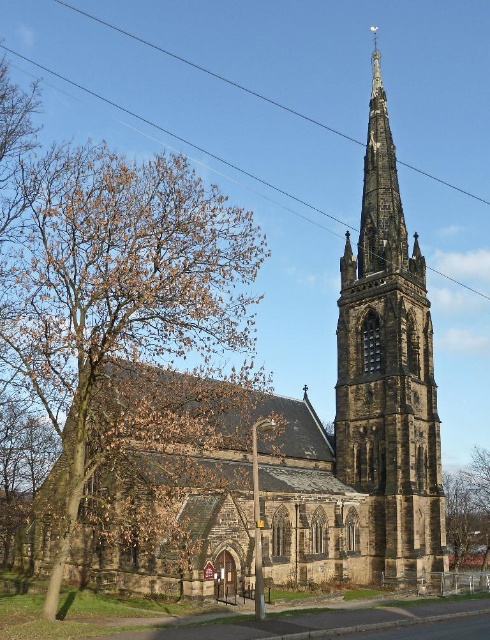
Does brown stone spire at center appear on the right side of brown leafy tree at lower right?

Incorrect, brown stone spire at center is not on the right side of brown leafy tree at lower right.

Does point (386, 186) lie in front of point (483, 461)?

Yes, it is.

Who is more forward, (344, 264) or (462, 484)?

Positioned in front is point (344, 264).

You are a GUI agent. You are given a task and a screenshot of the screen. Output one action in this format:
    pyautogui.click(x=<x>, y=<y>)
    Task: Click on the brown stone spire at center
    This screenshot has height=640, width=490.
    Given the screenshot: What is the action you would take?
    click(389, 372)

Is the position of brown leafy tree at left more distant than that of black wire at upper center?

No, it is not.

Is brown leafy tree at left thinner than black wire at upper center?

Yes, brown leafy tree at left is thinner than black wire at upper center.

Does point (103, 278) come in front of point (280, 193)?

Yes.

Locate an element on the screen. brown leafy tree at left is located at coordinates (123, 288).

Image resolution: width=490 pixels, height=640 pixels. What do you see at coordinates (123, 288) in the screenshot?
I see `brown leafy tree at left` at bounding box center [123, 288].

How much distance is there between brown leafy tree at left and brown leafy tree at lower right?

brown leafy tree at left and brown leafy tree at lower right are 46.72 meters apart.

I want to click on brown leafy tree at left, so click(123, 288).